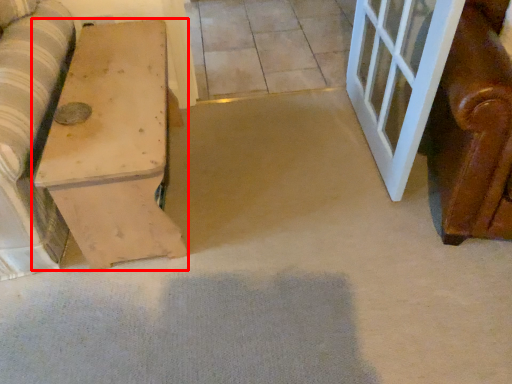
Question: Observing the image, what is the correct spatial positioning of furniture (annotated by the red box) in reference to tile?

Choices:
 (A) right
 (B) left

Answer: (B)